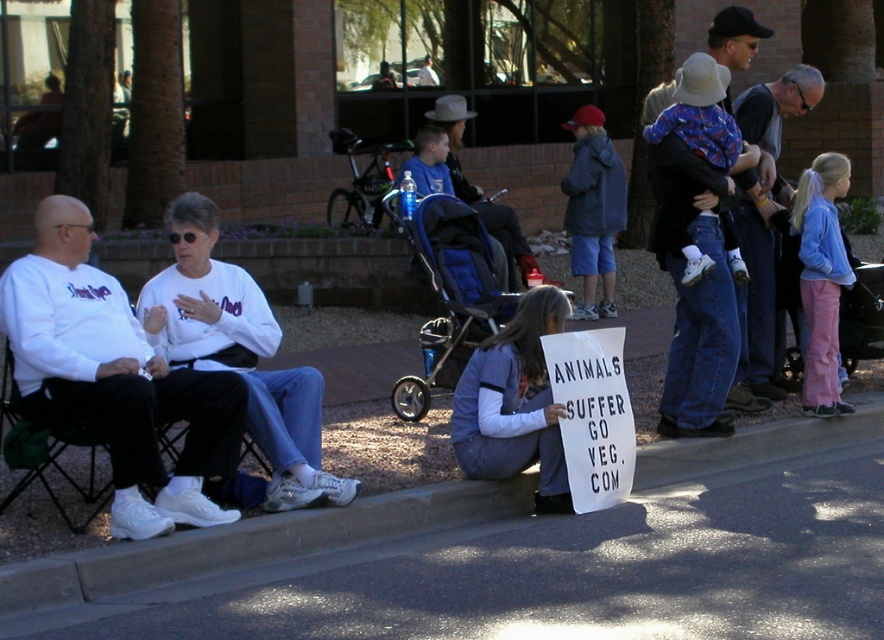
You are a photographer standing at the center of the street. You want to take a photo of the white matte shirt at left. Where should you aim your camera to capture it?

You should aim your camera at point (113, 378) to capture the white matte shirt at left.

Based on the photo, you are a photographer trying to capture a closeup of the text on the sign held by the young girl. You have a camera with a zoom lens. Considering the white matte shirt at left and the gray knit sweater at upper right, which clothing item would you focus on first to ensure the sign is in focus?

The white matte shirt at left is smaller in size compared to the gray knit sweater at upper right. Since the white matte shirt at left is closer to the camera, focusing on it first would help ensure the sign is in focus.